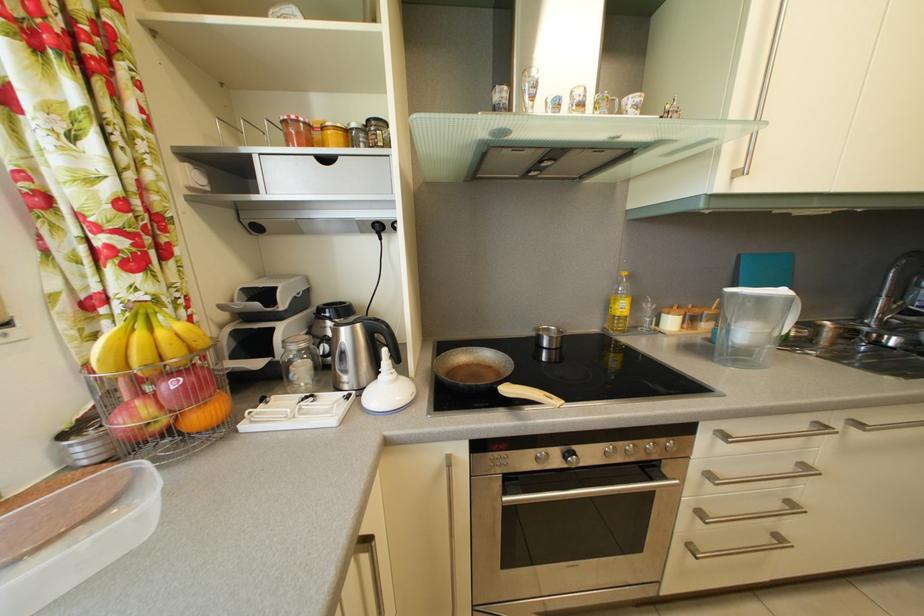
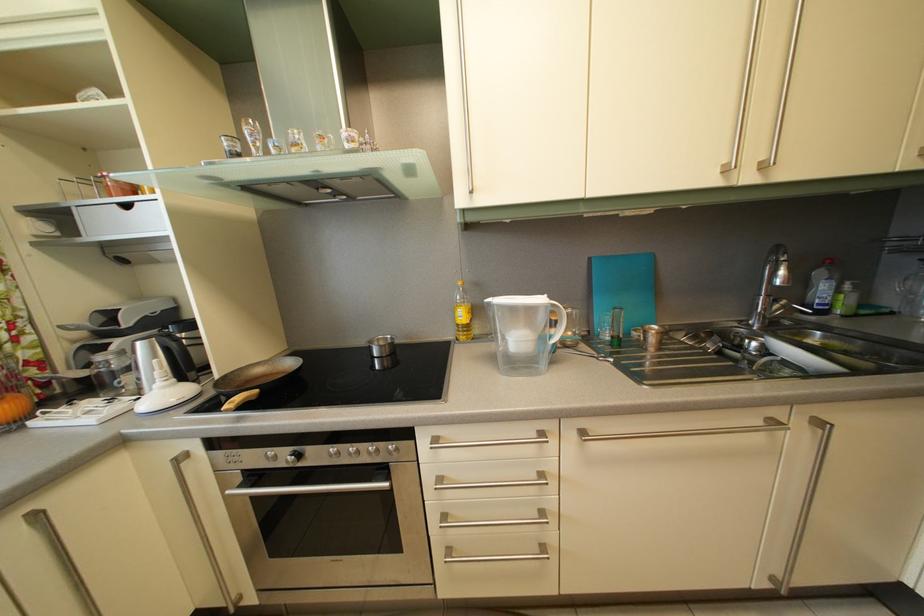
Question: The first image is from the beginning of the video and the second image is from the end. How did the camera likely rotate when shooting the video?

Choices:
 (A) Left
 (B) Right
 (C) Up
 (D) Down

Answer: (A)